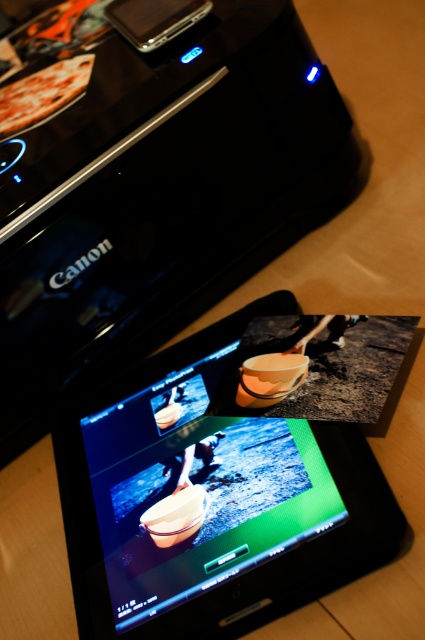
Question: Does black glossy tablet at center appear on the left side of golden pizza at upper left?

Choices:
 (A) no
 (B) yes

Answer: (A)

Question: Can you confirm if black glossy tablet at center is positioned above golden pizza at upper left?

Choices:
 (A) no
 (B) yes

Answer: (A)

Question: Does black glossy tablet at center have a larger size compared to golden pizza at upper left?

Choices:
 (A) no
 (B) yes

Answer: (B)

Question: Which point is farther to the camera?

Choices:
 (A) (240, 528)
 (B) (88, 54)

Answer: (B)

Question: Which point appears farthest from the camera in this image?

Choices:
 (A) (93, 528)
 (B) (36, 106)

Answer: (B)